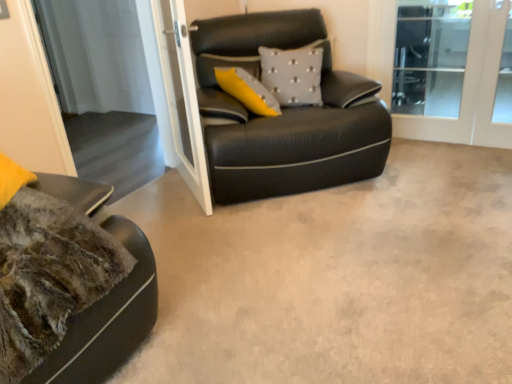
Question: Would you say gray textured pillow at center is a long distance from transparent glass screen door at upper center, acting as the 1th screen door starting from the left?

Choices:
 (A) yes
 (B) no

Answer: (B)

Question: From a real-world perspective, is gray textured pillow at center positioned under transparent glass screen door at upper center, acting as the 1th screen door starting from the left, based on gravity?

Choices:
 (A) yes
 (B) no

Answer: (B)

Question: Can you confirm if gray textured pillow at center is taller than transparent glass screen door at upper center, which is the 3th screen door in right-to-left order?

Choices:
 (A) yes
 (B) no

Answer: (B)

Question: Does gray textured pillow at center have a greater width compared to transparent glass screen door at upper center, acting as the 1th screen door starting from the left?

Choices:
 (A) no
 (B) yes

Answer: (B)

Question: From a real-world perspective, is gray textured pillow at center on top of transparent glass screen door at upper center, which is the 3th screen door in right-to-left order?

Choices:
 (A) no
 (B) yes

Answer: (B)

Question: Considering the positions of gray textured pillow at center and black leather studio couch at center in the image, is gray textured pillow at center taller or shorter than black leather studio couch at center?

Choices:
 (A) short
 (B) tall

Answer: (A)

Question: In the image, is gray textured pillow at center on the left side or the right side of black leather studio couch at center?

Choices:
 (A) left
 (B) right

Answer: (B)

Question: From a real-world perspective, is gray textured pillow at center positioned above or below black leather studio couch at center?

Choices:
 (A) below
 (B) above

Answer: (B)

Question: Is gray textured pillow at center in front of or behind black leather studio couch at center in the image?

Choices:
 (A) behind
 (B) front

Answer: (A)

Question: Would you say white glass screen door at upper center, which is the second screen door from left to right, is to the left or to the right of transparent glass screen door at upper center, acting as the 1th screen door starting from the left, in the picture?

Choices:
 (A) left
 (B) right

Answer: (B)

Question: Choose the correct answer: Is white glass screen door at upper center, which is the second screen door from left to right, inside transparent glass screen door at upper center, acting as the 1th screen door starting from the left, or outside it?

Choices:
 (A) outside
 (B) inside

Answer: (A)

Question: From the image's perspective, is white glass screen door at upper center, which is the second screen door from left to right, positioned above or below transparent glass screen door at upper center, which is the 3th screen door in right-to-left order?

Choices:
 (A) above
 (B) below

Answer: (B)

Question: From a real-world perspective, is white glass screen door at upper center, the second screen door viewed from the right, physically located above or below transparent glass screen door at upper center, which is the 3th screen door in right-to-left order?

Choices:
 (A) above
 (B) below

Answer: (B)

Question: Considering the positions of white glass screen door at upper center, which is the second screen door from left to right, and black leather studio couch at center in the image, is white glass screen door at upper center, which is the second screen door from left to right, wider or thinner than black leather studio couch at center?

Choices:
 (A) thin
 (B) wide

Answer: (A)

Question: Is white glass screen door at upper center, which is the second screen door from left to right, to the left or to the right of black leather studio couch at center in the image?

Choices:
 (A) right
 (B) left

Answer: (B)